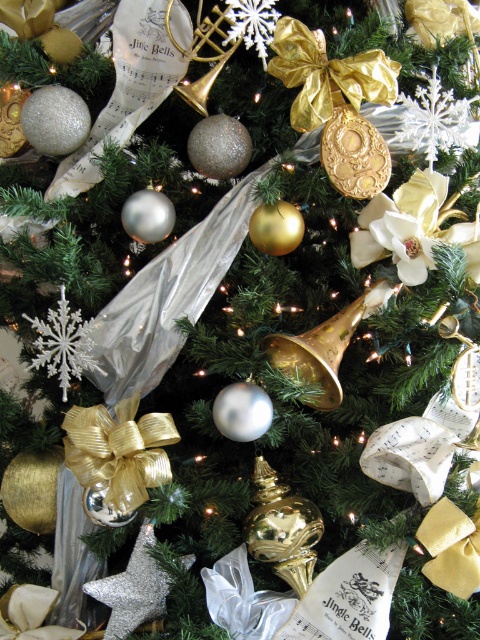
Question: Observing the image, what is the correct spatial positioning of gold shiny ribbon at center in reference to gold metallic trumpet at center?

Choices:
 (A) above
 (B) below

Answer: (B)

Question: Can you confirm if gold shiny ribbon at center is positioned to the left of gold shiny ribbon at upper center?

Choices:
 (A) no
 (B) yes

Answer: (B)

Question: Which point is farther from the camera taking this photo?

Choices:
 (A) (127, 499)
 (B) (312, 72)
 (C) (324, 342)
 (D) (197, 26)

Answer: (C)

Question: Is gold shiny ribbon at center further to the viewer compared to gold metallic trumpet at upper center?

Choices:
 (A) yes
 (B) no

Answer: (B)

Question: Which object is the closest to the gold metallic trumpet at center?

Choices:
 (A) gold shiny ribbon at upper center
 (B) gold shiny ribbon at center

Answer: (B)

Question: Which point appears closest to the camera in this image?

Choices:
 (A) (84, 456)
 (B) (208, 35)

Answer: (A)